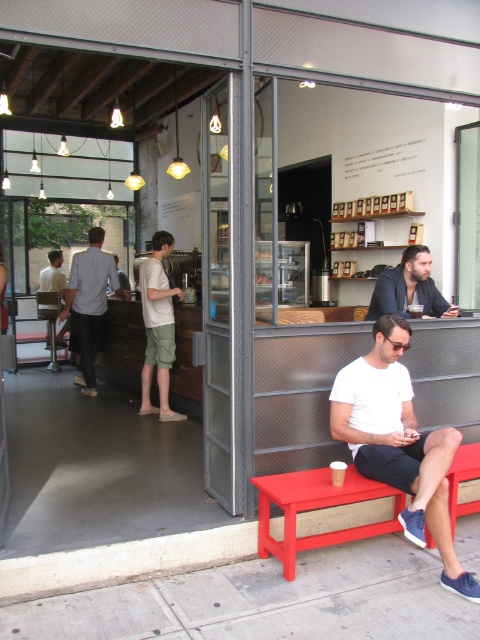
Question: Among these points, which one is farthest from the camera?

Choices:
 (A) (431, 541)
 (B) (369, 310)
 (C) (96, 301)

Answer: (C)

Question: Does white matte shirt at center come behind light blue shirt at center?

Choices:
 (A) yes
 (B) no

Answer: (B)

Question: Which point appears farthest from the camera in this image?

Choices:
 (A) (358, 528)
 (B) (168, 374)
 (C) (80, 259)
 (D) (382, 310)

Answer: (C)

Question: Which point is farther to the camera?

Choices:
 (A) (416, 269)
 (B) (347, 493)
 (C) (374, 401)

Answer: (A)

Question: Does matte red bench at lower center have a greater width compared to dark blue jacket at center?

Choices:
 (A) yes
 (B) no

Answer: (A)

Question: Can you confirm if light blue shirt at center is thinner than dark blue jacket at center?

Choices:
 (A) yes
 (B) no

Answer: (B)